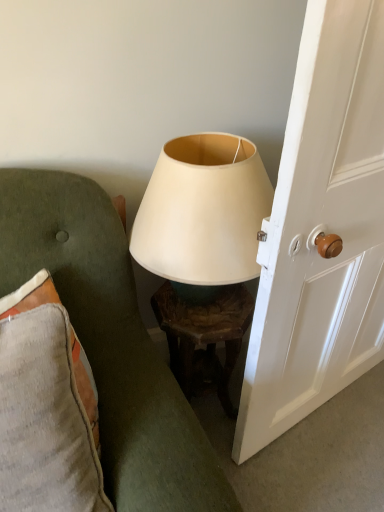
Question: Considering the relative sizes of wooden textured table at center and matte white lampshade at center in the image provided, is wooden textured table at center shorter than matte white lampshade at center?

Choices:
 (A) no
 (B) yes

Answer: (A)

Question: Is wooden textured table at center smaller than matte white lampshade at center?

Choices:
 (A) no
 (B) yes

Answer: (B)

Question: From the image's perspective, does wooden textured table at center appear lower than matte white lampshade at center?

Choices:
 (A) yes
 (B) no

Answer: (A)

Question: Would you say matte white lampshade at center is part of wooden textured table at center's contents?

Choices:
 (A) no
 (B) yes

Answer: (A)

Question: Does wooden textured table at center have a larger size compared to matte white lampshade at center?

Choices:
 (A) yes
 (B) no

Answer: (B)

Question: Which is correct: textured gray cushion at left is inside textured gray pillow at left, or outside of it?

Choices:
 (A) outside
 (B) inside

Answer: (B)

Question: Looking at the image, does textured gray cushion at left seem bigger or smaller compared to textured gray pillow at left?

Choices:
 (A) small
 (B) big

Answer: (B)

Question: Relative to textured gray pillow at left, is textured gray cushion at left in front or behind?

Choices:
 (A) front
 (B) behind

Answer: (A)

Question: Is textured gray cushion at left taller or shorter than textured gray pillow at left?

Choices:
 (A) tall
 (B) short

Answer: (A)

Question: Is matte white lampshade at center taller or shorter than textured gray cushion at left?

Choices:
 (A) short
 (B) tall

Answer: (A)

Question: In terms of size, does matte white lampshade at center appear bigger or smaller than textured gray cushion at left?

Choices:
 (A) big
 (B) small

Answer: (B)

Question: From the image's perspective, is matte white lampshade at center located above or below textured gray cushion at left?

Choices:
 (A) above
 (B) below

Answer: (A)

Question: From a real-world perspective, is matte white lampshade at center above or below textured gray cushion at left?

Choices:
 (A) below
 (B) above

Answer: (B)

Question: Is wooden textured table at center situated inside textured gray cushion at left or outside?

Choices:
 (A) outside
 (B) inside

Answer: (A)

Question: From a real-world perspective, relative to textured gray cushion at left, is wooden textured table at center vertically above or below?

Choices:
 (A) below
 (B) above

Answer: (A)